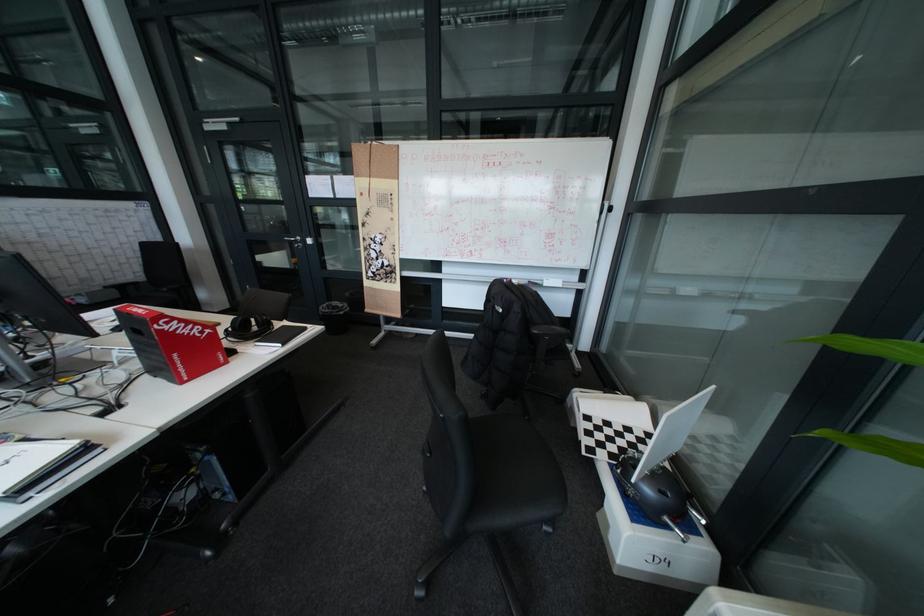
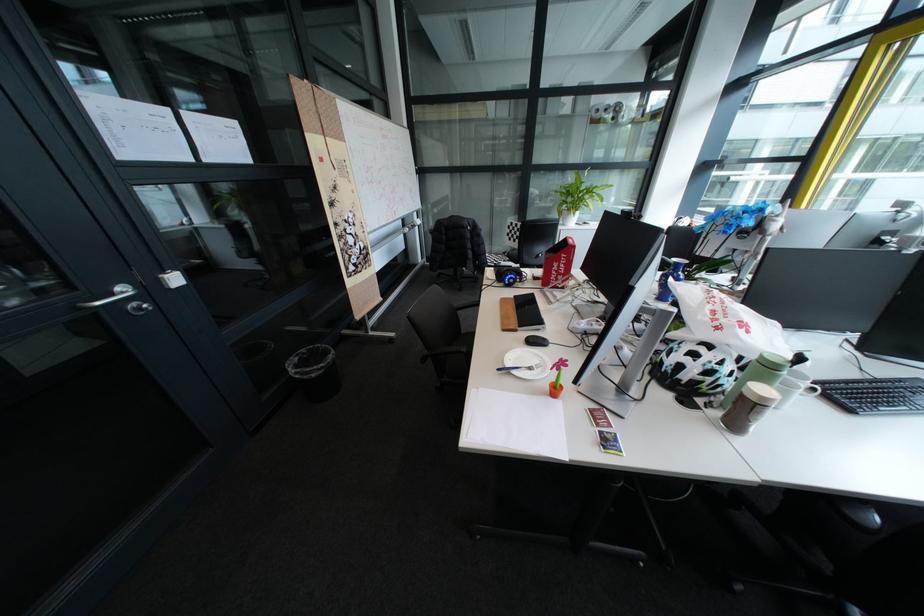
Question: I am providing you with two images of the same scene from different viewpoints. After the viewpoint changes to image2, which objects are now occluded?

Choices:
 (A) blue handled tool
 (B) black chair sitting surface
 (C) blue headphones
 (D) orange flower pot

Answer: (B)